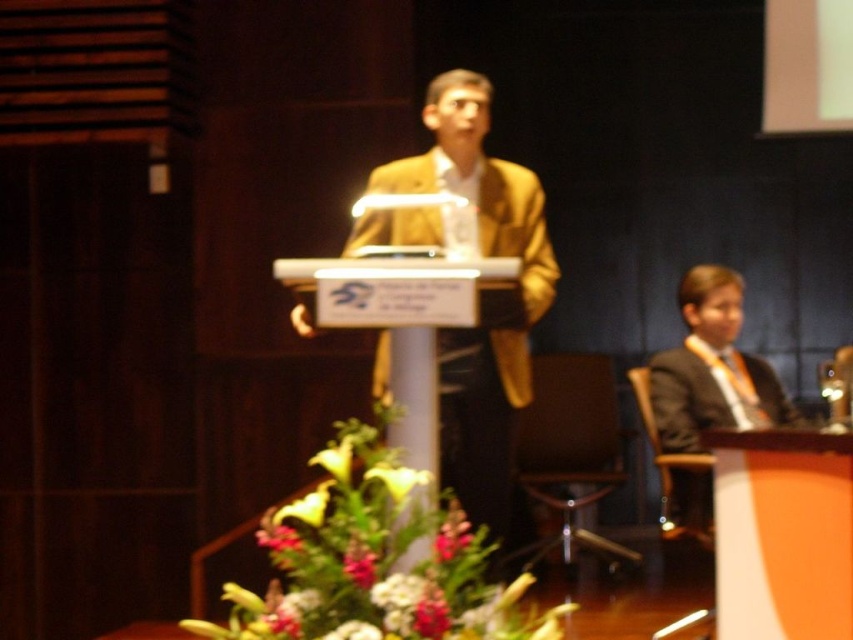
Can you confirm if yellow matte flower at center is positioned to the right of white glossy lily at center?

Indeed, yellow matte flower at center is positioned on the right side of white glossy lily at center.

Consider the image. Between yellow matte flower at center and white glossy lily at center, which one appears on the left side from the viewer's perspective?

From the viewer's perspective, white glossy lily at center appears more on the left side.

Based on the photo, who is more forward, (x=403, y=474) or (x=345, y=470)?

Positioned in front is point (x=345, y=470).

The height and width of the screenshot is (640, 853). Identify the location of yellow matte flower at center. [398, 477].

Can you confirm if matte black suit at right is positioned to the left of white glossy lily at center?

Incorrect, matte black suit at right is not on the left side of white glossy lily at center.

Locate an element on the screen. matte black suit at right is located at coordinates (712, 369).

Is green leafy plant at center below white glossy lily at center?

Yes, green leafy plant at center is below white glossy lily at center.

Between point (395, 541) and point (310, 458), which one is positioned behind?

Positioned behind is point (310, 458).

Does point (491, 636) come closer to viewer compared to point (337, 458)?

Yes, it is.

Where is `green leafy plant at center`? This screenshot has width=853, height=640. green leafy plant at center is located at coordinates (375, 568).